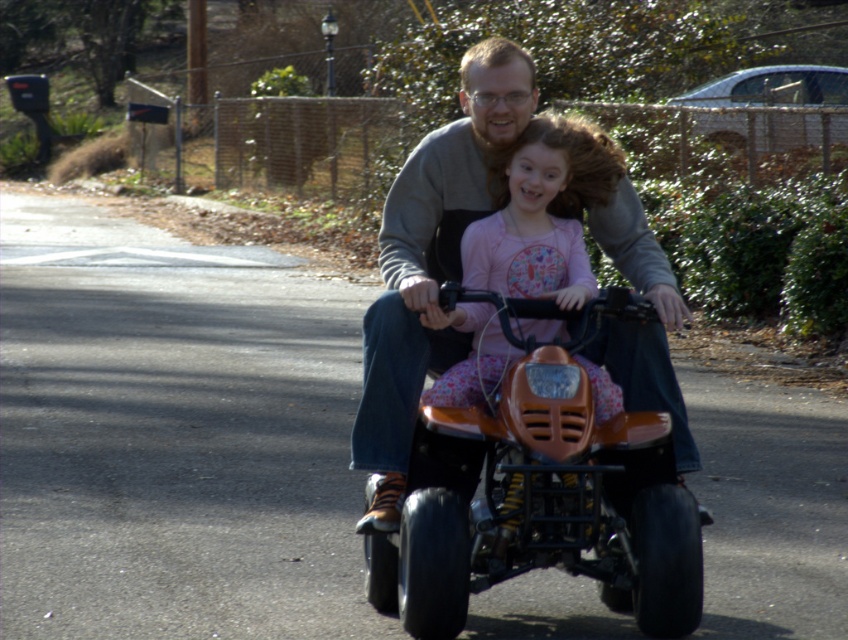
Question: Is matte gray sweatshirt at center thinner than pink fabric dress at center?

Choices:
 (A) no
 (B) yes

Answer: (B)

Question: Is matte gray sweatshirt at center closer to camera compared to pink fabric dress at center?

Choices:
 (A) yes
 (B) no

Answer: (B)

Question: Which of the following is the farthest from the observer?

Choices:
 (A) (382, 508)
 (B) (511, 150)

Answer: (B)

Question: Where is matte gray sweatshirt at center located in relation to pink fabric dress at center in the image?

Choices:
 (A) above
 (B) below

Answer: (B)

Question: Among these objects, which one is nearest to the camera?

Choices:
 (A) matte gray sweatshirt at center
 (B) pink fabric dress at center

Answer: (B)